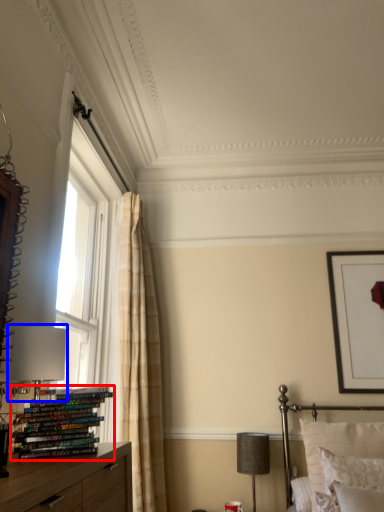
Question: Which point is closer to the camera, book (highlighted by a red box) or table lamp (highlighted by a blue box)?

Choices:
 (A) book
 (B) table lamp

Answer: (A)